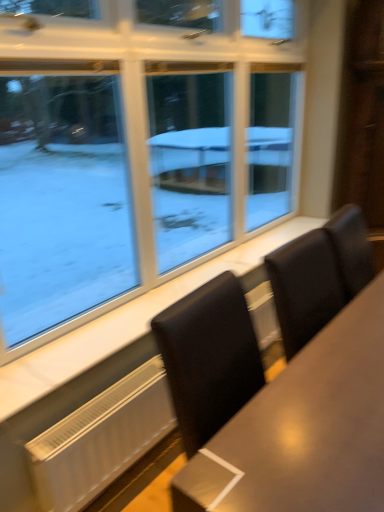
Question: From a real-world perspective, is clear glass window at upper left physically below white marble window sill at lower center?

Choices:
 (A) yes
 (B) no

Answer: (B)

Question: Can you confirm if clear glass window at upper left is thinner than white marble window sill at lower center?

Choices:
 (A) no
 (B) yes

Answer: (B)

Question: Can you see clear glass window at upper left touching white marble window sill at lower center?

Choices:
 (A) no
 (B) yes

Answer: (A)

Question: Can you confirm if clear glass window at upper left is smaller than white marble window sill at lower center?

Choices:
 (A) no
 (B) yes

Answer: (A)

Question: Does clear glass window at upper left have a greater width compared to white marble window sill at lower center?

Choices:
 (A) no
 (B) yes

Answer: (A)

Question: Considering the positions of clear glass window at upper left and white marble window sill at lower center in the image, is clear glass window at upper left taller or shorter than white marble window sill at lower center?

Choices:
 (A) tall
 (B) short

Answer: (A)

Question: From the image's perspective, relative to white marble window sill at lower center, is clear glass window at upper left above or below?

Choices:
 (A) above
 (B) below

Answer: (A)

Question: From a real-world perspective, is clear glass window at upper left positioned above or below white marble window sill at lower center?

Choices:
 (A) below
 (B) above

Answer: (B)

Question: Is clear glass window at upper left bigger or smaller than white marble window sill at lower center?

Choices:
 (A) small
 (B) big

Answer: (B)

Question: From a real-world perspective, relative to clear glass window at upper left, is matte brown table at center vertically above or below?

Choices:
 (A) above
 (B) below

Answer: (B)

Question: Visually, is matte brown table at center positioned to the left or to the right of clear glass window at upper left?

Choices:
 (A) right
 (B) left

Answer: (A)

Question: Looking at their shapes, would you say matte brown table at center is wider or thinner than clear glass window at upper left?

Choices:
 (A) wide
 (B) thin

Answer: (A)

Question: Considering the positions of matte brown table at center and clear glass window at upper left in the image, is matte brown table at center taller or shorter than clear glass window at upper left?

Choices:
 (A) tall
 (B) short

Answer: (B)

Question: In terms of height, does white matte radiator at lower left look taller or shorter compared to white marble window sill at lower center?

Choices:
 (A) short
 (B) tall

Answer: (B)

Question: In terms of size, does white matte radiator at lower left appear bigger or smaller than white marble window sill at lower center?

Choices:
 (A) big
 (B) small

Answer: (A)